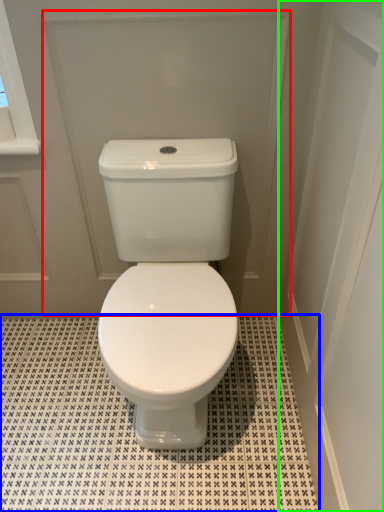
Question: Estimate the real-world distances between objects in this image. Which object is farther from screen door (highlighted by a red box), tile (highlighted by a blue box) or screen door (highlighted by a green box)?

Choices:
 (A) tile
 (B) screen door

Answer: (A)